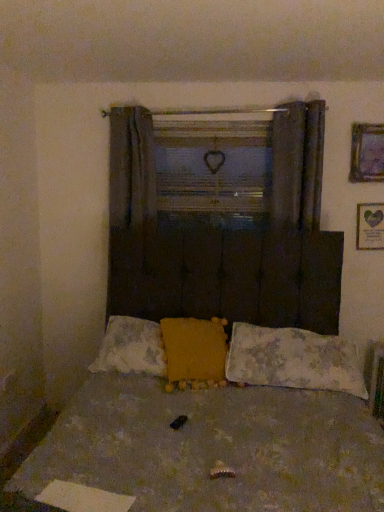
Question: Considering the positions of point [114, 360] and point [345, 375], is point [114, 360] closer or farther from the camera than point [345, 375]?

Choices:
 (A) farther
 (B) closer

Answer: (A)

Question: Considering the positions of fluffy yellow pillow at center, arranged as the third pillow when viewed from the right, and fluffy white pillow at center, which is the first pillow in right-to-left order, in the image, is fluffy yellow pillow at center, arranged as the third pillow when viewed from the right, taller or shorter than fluffy white pillow at center, which is the first pillow in right-to-left order,?

Choices:
 (A) short
 (B) tall

Answer: (A)

Question: Considering the real-world distances, which object is closest to the purple glass picture frame at upper right, the 2th picture frame in the bottom-to-top sequence?

Choices:
 (A) dark gray fabric curtain at upper center
 (B) wooden frame at center
 (C) fluffy white pillow at center, which ranks as the 3th pillow in left-to-right order
 (D) green paper picture frame at upper right, which is counted as the second picture frame, starting from the top
 (E) fluffy yellow pillow at center, placed as the 1th pillow when sorted from left to right

Answer: (D)

Question: Which object is positioned closest to the white plastic radiator at lower right?

Choices:
 (A) fluffy fabric bed at center
 (B) dark gray fabric curtain at upper center
 (C) green paper picture frame at upper right, which is counted as the second picture frame, starting from the top
 (D) yellow fabric pillow at center, which appears as the second pillow when viewed from the right
 (E) wooden frame at center

Answer: (A)